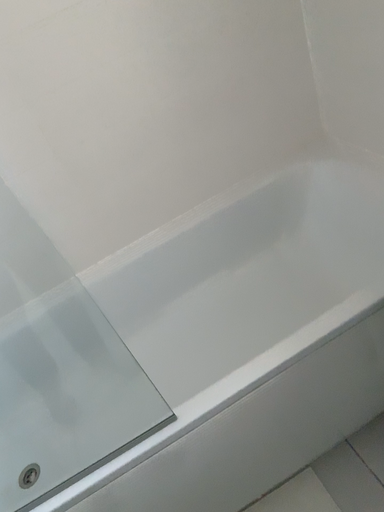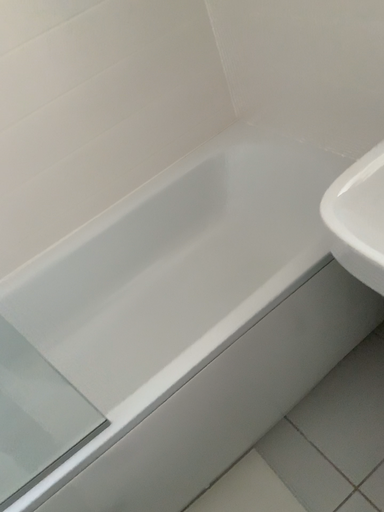
Question: Which way did the camera rotate in the video?

Choices:
 (A) rotated left
 (B) rotated right

Answer: (B)